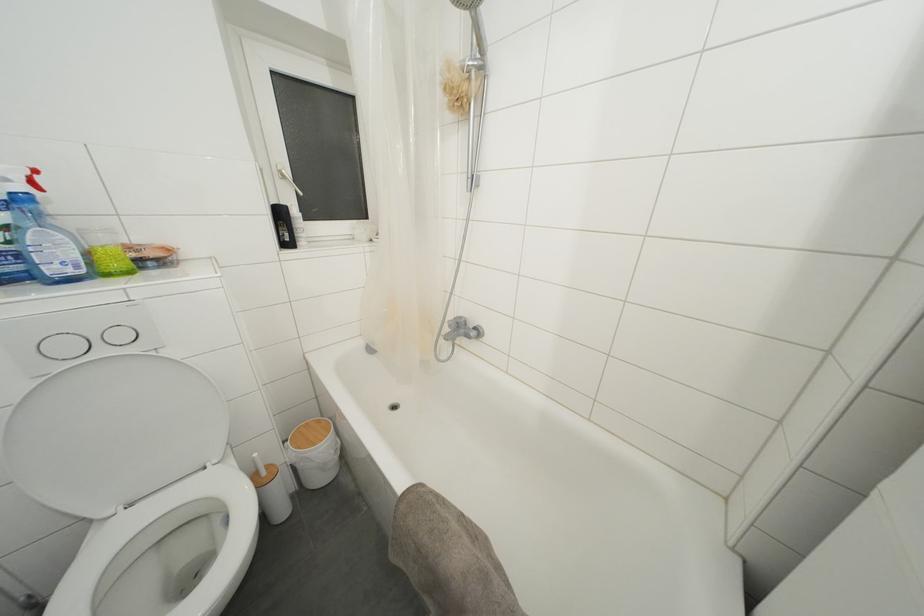
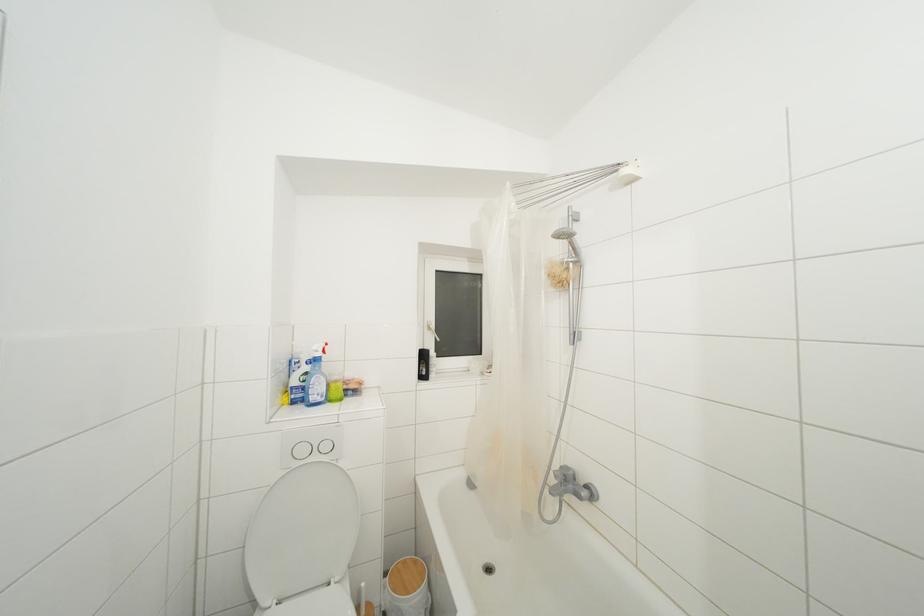
In the second image, find the point that corresponds to pixel 71 352 in the first image.

(307, 456)